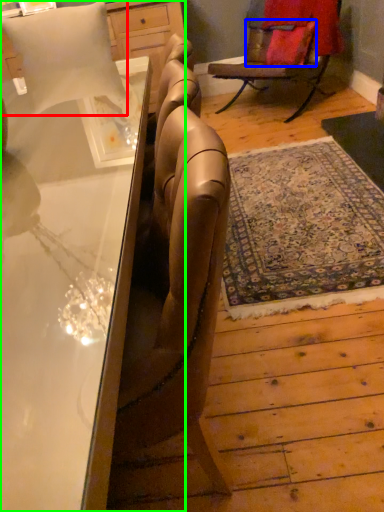
Question: Based on their relative distances, which object is nearer to pillow (highlighted by a red box)? Choose from pillow (highlighted by a blue box) and desk (highlighted by a green box).

Choices:
 (A) pillow
 (B) desk

Answer: (B)